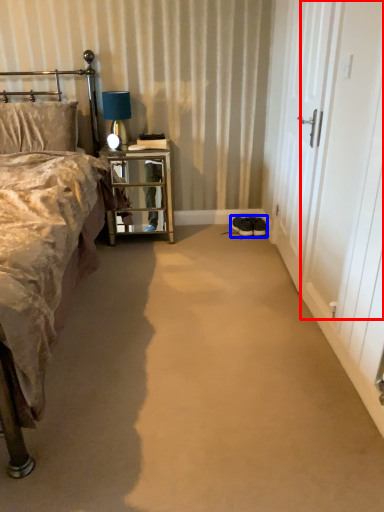
Question: Which object is closer to the camera taking this photo, screen door (highlighted by a red box) or footwear (highlighted by a blue box)?

Choices:
 (A) screen door
 (B) footwear

Answer: (A)